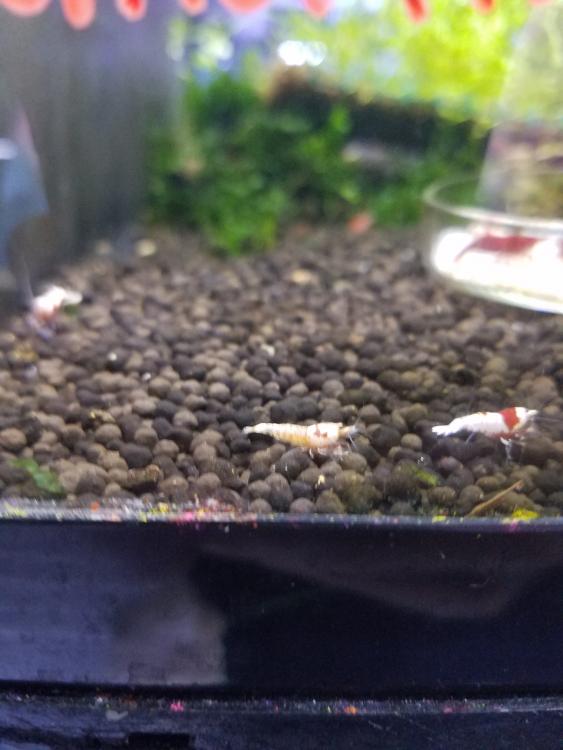
At what (x,y) coordinates should I click in order to perform the action: click on frame. Please return your answer as a coordinate pair (x, y). Looking at the image, I should click on (321, 553).